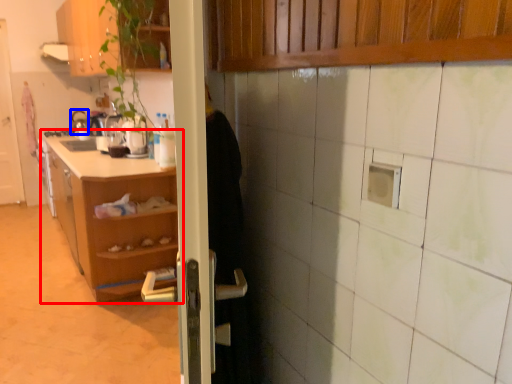
Question: Which of the following is the closest to the observer, shelf (highlighted by a red box) or appliance (highlighted by a blue box)?

Choices:
 (A) shelf
 (B) appliance

Answer: (A)